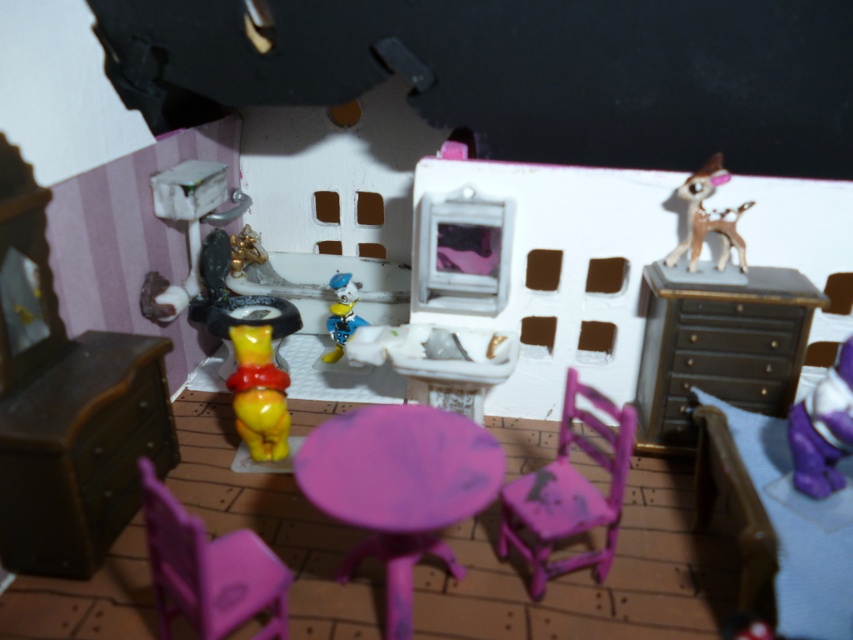
Who is shorter, matte brown dresser at lower left or matte plastic chair at center?

Standing shorter between the two is matte plastic chair at center.

Is matte brown dresser at lower left above matte plastic chair at center?

Indeed, matte brown dresser at lower left is positioned over matte plastic chair at center.

Between point (90, 573) and point (611, 547), which one is positioned behind?

The point (90, 573) is more distant.

This screenshot has width=853, height=640. Find the location of `matte brown dresser at lower left`. matte brown dresser at lower left is located at coordinates (80, 451).

Is purple matte table at center bigger than yellow matte winnie the pooh at center?

Yes, purple matte table at center is bigger than yellow matte winnie the pooh at center.

Does point (456, 452) come farther from viewer compared to point (231, 390)?

Yes, it is.

Which is in front, point (408, 536) or point (260, 378)?

Point (408, 536) is more forward.

This screenshot has height=640, width=853. In order to click on purple matte table at center in this screenshot , I will do `click(399, 486)`.

Is matte plastic chair at center below brown glossy deer at upper right?

Indeed, matte plastic chair at center is positioned under brown glossy deer at upper right.

Is point (575, 522) positioned behind point (718, 221)?

No, (575, 522) is in front of (718, 221).

Image resolution: width=853 pixels, height=640 pixels. What are the coordinates of `matte plastic chair at center` in the screenshot? It's located at [569, 492].